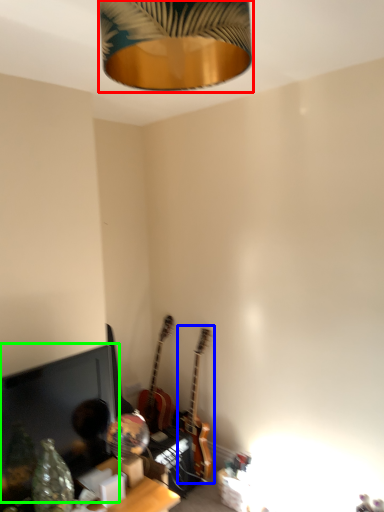
Question: Considering the real-world distances, which object is farthest from lamp (highlighted by a red box)? guitar (highlighted by a blue box) or computer monitor (highlighted by a green box)?

Choices:
 (A) guitar
 (B) computer monitor

Answer: (A)